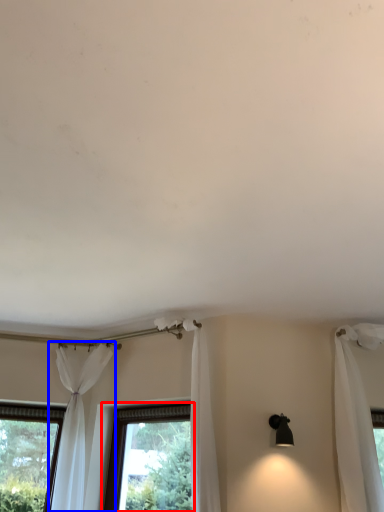
Question: Among these objects, which one is farthest to the camera, window (highlighted by a red box) or curtain (highlighted by a blue box)?

Choices:
 (A) window
 (B) curtain

Answer: (A)